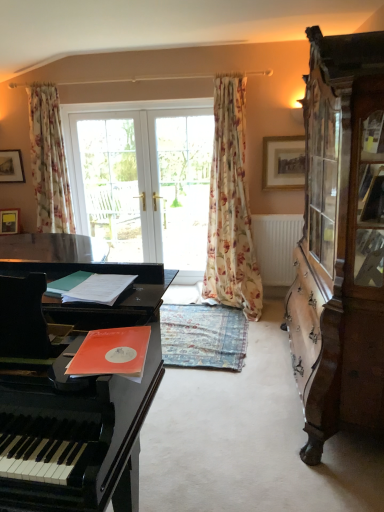
Describe the element at coordinates (184, 187) in the screenshot. I see `white glossy door at center, which ranks as the 2th screen door in left-to-right order` at that location.

The height and width of the screenshot is (512, 384). What do you see at coordinates (283, 163) in the screenshot? I see `wooden framed picture at upper right` at bounding box center [283, 163].

Measure the distance between point (x=330, y=337) and camera.

Point (x=330, y=337) and camera are 7.01 feet apart from each other.

What do you see at coordinates (113, 182) in the screenshot? The image size is (384, 512). I see `clear glass door at center, which appears as the second screen door when viewed from the right` at bounding box center [113, 182].

Find the location of a particular element. This screenshot has width=384, height=512. floral fabric curtain at upper left, which is the 1th curtain from left to right is located at coordinates (49, 161).

Considering the relative positions of floral fabric curtain at upper left, which is the 1th curtain from left to right, and floral fabric curtain at center, the first curtain from the right, in the image provided, is floral fabric curtain at upper left, which is the 1th curtain from left to right, to the right of floral fabric curtain at center, the first curtain from the right, from the viewer's perspective?

Incorrect, floral fabric curtain at upper left, which is the 1th curtain from left to right, is not on the right side of floral fabric curtain at center, the first curtain from the right.

From a real-world perspective, does floral fabric curtain at upper left, acting as the 2th curtain starting from the right, stand above floral fabric curtain at center, the 2th curtain positioned from the left?

Yes, from a real-world perspective, floral fabric curtain at upper left, acting as the 2th curtain starting from the right, is on top of floral fabric curtain at center, the 2th curtain positioned from the left.

Considering the sizes of objects floral fabric curtain at upper left, acting as the 2th curtain starting from the right, and floral fabric curtain at center, the first curtain from the right, in the image provided, who is taller, floral fabric curtain at upper left, acting as the 2th curtain starting from the right, or floral fabric curtain at center, the first curtain from the right,?

floral fabric curtain at center, the first curtain from the right, is taller.

Could you measure the distance between floral fabric curtain at upper left, acting as the 2th curtain starting from the right, and floral fabric curtain at center, the first curtain from the right?

The distance of floral fabric curtain at upper left, acting as the 2th curtain starting from the right, from floral fabric curtain at center, the first curtain from the right, is 1.69 meters.

This screenshot has height=512, width=384. Identify the location of cabinetry on the right of wooden framed picture at upper right. (340, 241).

From a real-world perspective, is wooden cabinet at right on wooden framed picture at upper right?

No.

Is wooden cabinet at right not close to wooden framed picture at upper right?

Yes, wooden cabinet at right and wooden framed picture at upper right are quite far apart.

Considering the sizes of wooden cabinet at right and wooden framed picture at upper right in the image, is wooden cabinet at right bigger or smaller than wooden framed picture at upper right?

wooden cabinet at right is bigger than wooden framed picture at upper right.

How distant is floral fabric curtain at upper left, which is the 1th curtain from left to right, from white glass doors at center?

19.38 inches.

Between floral fabric curtain at upper left, acting as the 2th curtain starting from the right, and white glass doors at center, which one has more height?

white glass doors at center.

Locate an element on the screen. This screenshot has width=384, height=512. bay window behind the floral fabric curtain at upper left, which is the 1th curtain from left to right is located at coordinates (145, 179).

Is floral fabric curtain at upper left, acting as the 2th curtain starting from the right, outside of white glass doors at center?

floral fabric curtain at upper left, acting as the 2th curtain starting from the right, lies outside white glass doors at center's area.

How different are the orientations of wooden cabinet at right and white glossy door at center, which ranks as the 2th screen door in left-to-right order, in degrees?

87.7 degrees.

From the image's perspective, which one is positioned lower, wooden cabinet at right or white glossy door at center, which is the first screen door from right to left?

wooden cabinet at right appears lower in the image.

I want to click on cabinetry above the white glossy door at center, which ranks as the 2th screen door in left-to-right order (from a real-world perspective), so [340, 241].

Do you think white glass doors at center is within wooden cabinet at right, or outside of it?

white glass doors at center is not inside wooden cabinet at right, it's outside.

Is white glass doors at center in front of or behind wooden cabinet at right in the image?

Clearly, white glass doors at center is behind wooden cabinet at right.

The height and width of the screenshot is (512, 384). Identify the location of cabinetry in front of the white glass doors at center. (340, 241).

From a real-world perspective, relative to wooden cabinet at right, is white glass doors at center vertically above or below?

white glass doors at center is situated lower than wooden cabinet at right in the real world.

Can you confirm if white glossy door at center, which is the first screen door from right to left, is positioned to the left of clear glass door at center, positioned as the first screen door in left-to-right order?

No.

In terms of height, does white glossy door at center, which is the first screen door from right to left, look taller or shorter compared to clear glass door at center, which appears as the second screen door when viewed from the right?

white glossy door at center, which is the first screen door from right to left, is taller than clear glass door at center, which appears as the second screen door when viewed from the right.

Is white glossy door at center, which is the first screen door from right to left, oriented towards clear glass door at center, which appears as the second screen door when viewed from the right?

No, white glossy door at center, which is the first screen door from right to left, is not aimed at clear glass door at center, which appears as the second screen door when viewed from the right.

Is white glossy door at center, which ranks as the 2th screen door in left-to-right order, inside the boundaries of wooden framed picture at upper right, or outside?

The correct answer is: outside.

Is white glossy door at center, which is the first screen door from right to left, turned away from wooden framed picture at upper right?

No, wooden framed picture at upper right is not at the back of white glossy door at center, which is the first screen door from right to left.

Can you tell me how much white glossy door at center, which is the first screen door from right to left, and wooden framed picture at upper right differ in facing direction?

1.93 degrees.

Can you confirm if white glossy door at center, which is the first screen door from right to left, is taller than wooden framed picture at upper right?

Indeed, white glossy door at center, which is the first screen door from right to left, has a greater height compared to wooden framed picture at upper right.

The image size is (384, 512). In order to click on curtain lying on the left of floral fabric curtain at center, the 2th curtain positioned from the left in this screenshot , I will do [x=49, y=161].

Where is `cabinetry in front of the wooden framed picture at upper right`? The height and width of the screenshot is (512, 384). cabinetry in front of the wooden framed picture at upper right is located at coordinates (340, 241).

Based on their spatial positions, is floral fabric curtain at center, the 2th curtain positioned from the left, or wooden framed picture at upper right further from floral fabric curtain at upper left, which is the 1th curtain from left to right?

A: Among the two, wooden framed picture at upper right is located further to floral fabric curtain at upper left, which is the 1th curtain from left to right.

From the image, which object appears to be nearer to floral fabric curtain at upper left, acting as the 2th curtain starting from the right, wooden framed picture at upper right or white glossy door at center, which ranks as the 2th screen door in left-to-right order?

white glossy door at center, which ranks as the 2th screen door in left-to-right order, is closer to floral fabric curtain at upper left, acting as the 2th curtain starting from the right.

From the image, which object appears to be farther from black polished piano at left, white glass doors at center or white matte radiator at center?

Among the two, white glass doors at center is located further to black polished piano at left.

Looking at the image, which one is located closer to wooden cabinet at right, floral fabric curtain at center, the first curtain from the right, or floral fabric curtain at upper left, which is the 1th curtain from left to right?

floral fabric curtain at center, the first curtain from the right, is closer to wooden cabinet at right.

Looking at the image, which one is located closer to black polished piano at left, floral fabric curtain at center, the first curtain from the right, or white glossy door at center, which ranks as the 2th screen door in left-to-right order?

Based on the image, floral fabric curtain at center, the first curtain from the right, appears to be nearer to black polished piano at left.

Based on their spatial positions, is wooden cabinet at right or clear glass door at center, which appears as the second screen door when viewed from the right, closer to white glossy door at center, which ranks as the 2th screen door in left-to-right order?

clear glass door at center, which appears as the second screen door when viewed from the right.

Considering their positions, is floral fabric curtain at center, the first curtain from the right, positioned further to floral fabric curtain at upper left, acting as the 2th curtain starting from the right, than clear glass door at center, which appears as the second screen door when viewed from the right?

floral fabric curtain at center, the first curtain from the right, is positioned further to the anchor floral fabric curtain at upper left, acting as the 2th curtain starting from the right.

Which object lies nearer to the anchor point floral fabric curtain at upper left, acting as the 2th curtain starting from the right, white glass doors at center or white matte radiator at center?

white glass doors at center is positioned closer to the anchor floral fabric curtain at upper left, acting as the 2th curtain starting from the right.

Where is `picture frame located between black polished piano at left and white glass doors at center in the depth direction`? This screenshot has width=384, height=512. picture frame located between black polished piano at left and white glass doors at center in the depth direction is located at coordinates (283, 163).

The height and width of the screenshot is (512, 384). I want to click on picture frame located between floral fabric curtain at upper left, which is the 1th curtain from left to right, and wooden cabinet at right in the left-right direction, so click(x=283, y=163).

Where is `curtain situated between floral fabric curtain at upper left, which is the 1th curtain from left to right, and white matte radiator at center from left to right`? This screenshot has height=512, width=384. curtain situated between floral fabric curtain at upper left, which is the 1th curtain from left to right, and white matte radiator at center from left to right is located at coordinates (231, 207).

This screenshot has width=384, height=512. I want to click on curtain between black polished piano at left and floral fabric curtain at upper left, which is the 1th curtain from left to right, from front to back, so click(x=231, y=207).